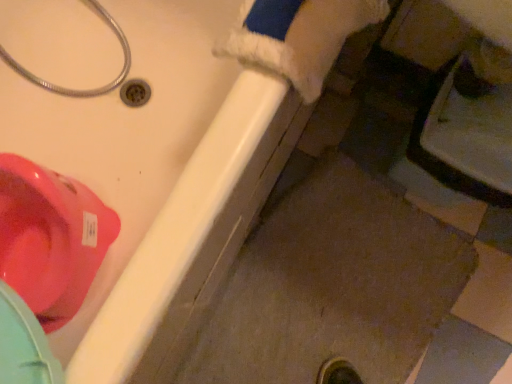
Question: Relative to metallic silver hose at upper left, is matte white bathtub at lower left in front or behind?

Choices:
 (A) behind
 (B) front

Answer: (B)

Question: Would you say matte white bathtub at lower left is inside or outside metallic silver hose at upper left?

Choices:
 (A) outside
 (B) inside

Answer: (A)

Question: Which is nearer to the glossy plastic toilet at upper left?

Choices:
 (A) matte white bathtub at lower left
 (B) metallic silver hose at upper left

Answer: (A)

Question: Which object is positioned closest to the metallic silver hose at upper left?

Choices:
 (A) matte white bathtub at lower left
 (B) glossy plastic toilet at upper left

Answer: (B)